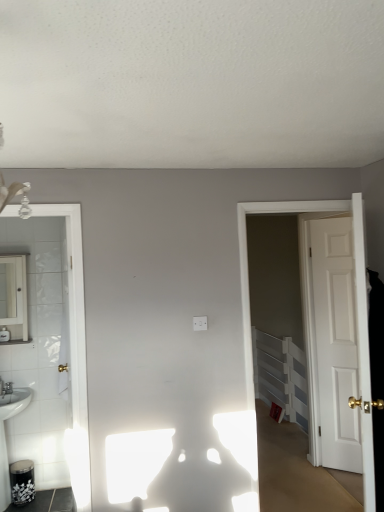
Question: Is the depth of white plastic radiator at right greater than that of white glossy sink at lower left?

Choices:
 (A) no
 (B) yes

Answer: (B)

Question: From a real-world perspective, is white plastic radiator at right under white glossy sink at lower left?

Choices:
 (A) yes
 (B) no

Answer: (B)

Question: Is white plastic radiator at right at the right side of white glossy sink at lower left?

Choices:
 (A) no
 (B) yes

Answer: (B)

Question: Is white plastic radiator at right far from white glossy sink at lower left?

Choices:
 (A) yes
 (B) no

Answer: (A)

Question: From the image's perspective, is white plastic radiator at right below white glossy sink at lower left?

Choices:
 (A) yes
 (B) no

Answer: (B)

Question: Can you confirm if white plastic radiator at right is smaller than white glossy sink at lower left?

Choices:
 (A) no
 (B) yes

Answer: (B)

Question: Is white glossy sink at lower left turned away from white glossy mirror at left?

Choices:
 (A) no
 (B) yes

Answer: (A)

Question: From the image's perspective, is white glossy sink at lower left below white glossy mirror at left?

Choices:
 (A) no
 (B) yes

Answer: (B)

Question: Can you confirm if white glossy sink at lower left is thinner than white glossy mirror at left?

Choices:
 (A) no
 (B) yes

Answer: (A)

Question: Is white glossy mirror at left inside white glossy sink at lower left?

Choices:
 (A) yes
 (B) no

Answer: (B)

Question: Is white glossy sink at lower left beside white glossy mirror at left?

Choices:
 (A) no
 (B) yes

Answer: (A)

Question: From a real-world perspective, is white glossy sink at lower left on top of white glossy mirror at left?

Choices:
 (A) no
 (B) yes

Answer: (A)

Question: Is white plastic radiator at right turned away from white matte door at right, the 2th door when ordered from left to right?

Choices:
 (A) no
 (B) yes

Answer: (A)